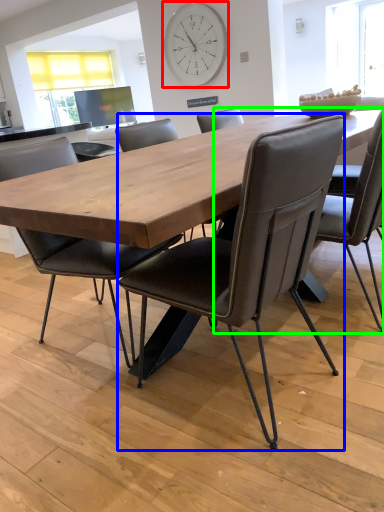
Question: Which object is the closest to the clock (highlighted by a red box)? Choose among these: chair (highlighted by a blue box) or chair (highlighted by a green box).

Choices:
 (A) chair
 (B) chair

Answer: (B)